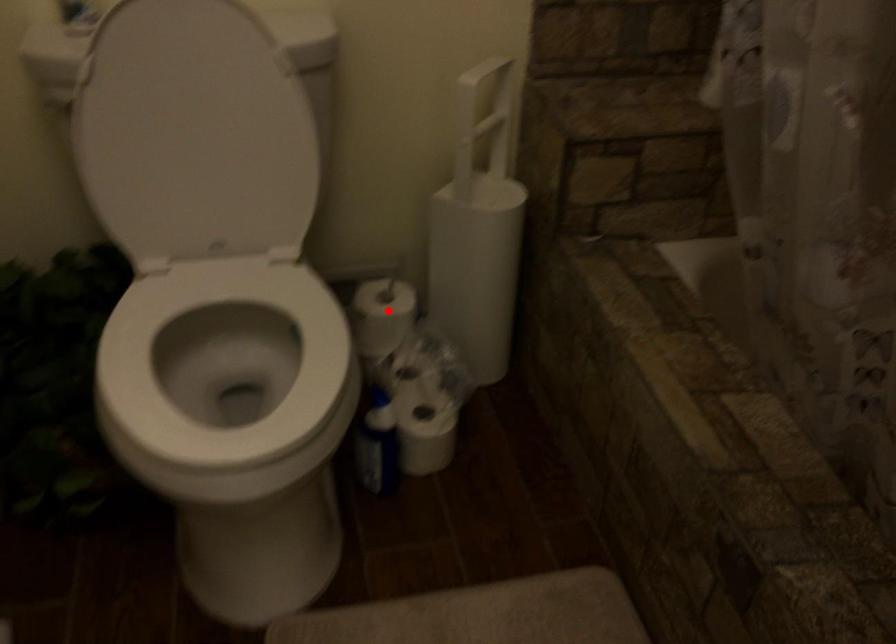
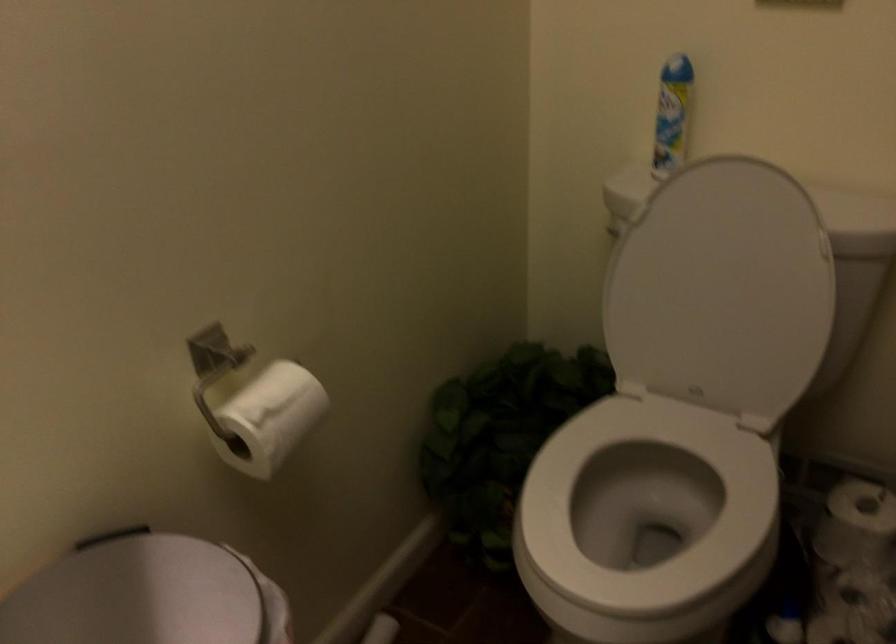
Question: I am providing you with two images of the same scene from different viewpoints. Given a red point in image1, look at the same physical point in image2. Is it:

Choices:
 (A) Closer to the viewpoint
 (B) Farther from the viewpoint

Answer: (A)